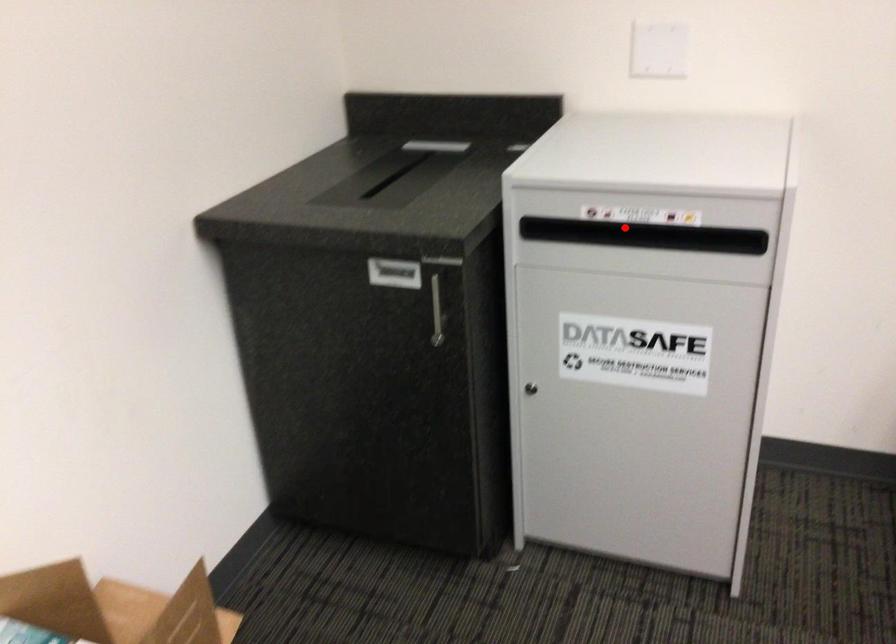
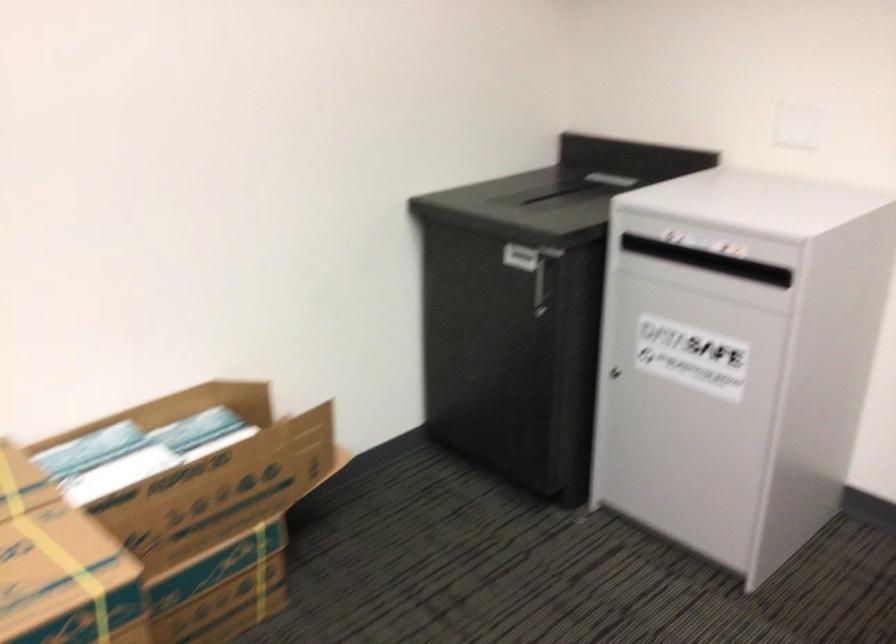
Find the pixel in the second image that matches the highlighted location in the first image.

(748, 269)